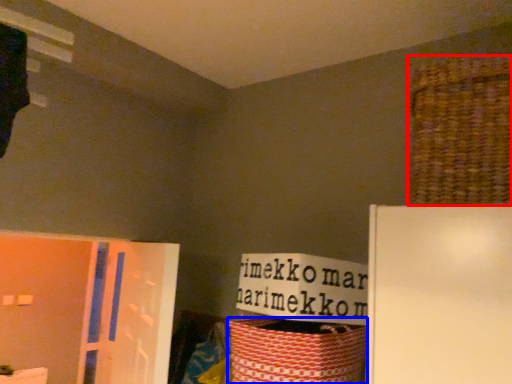
Question: Which object appears closest to the camera in this image, basket (highlighted by a red box) or basket (highlighted by a blue box)?

Choices:
 (A) basket
 (B) basket

Answer: (A)